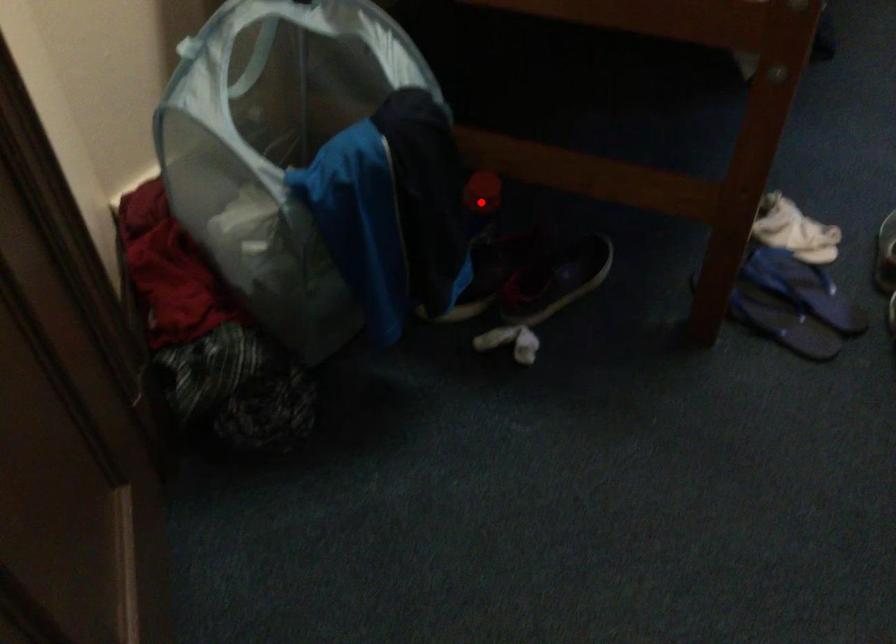
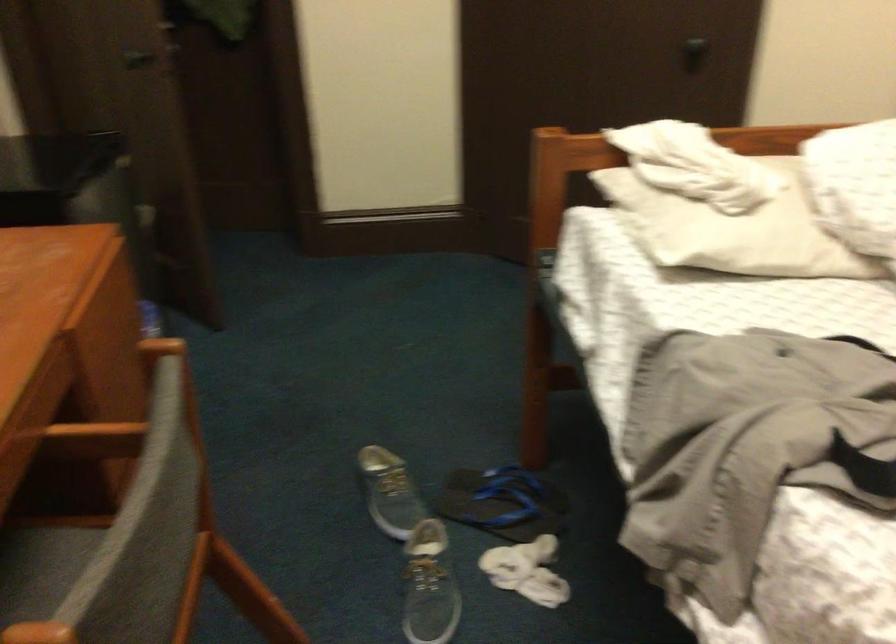
Question: I am providing you with two images of the same scene from different viewpoints. A red point is marked on the first image. Can you still see the location of the red point in image 2?

Choices:
 (A) Yes
 (B) No

Answer: (B)